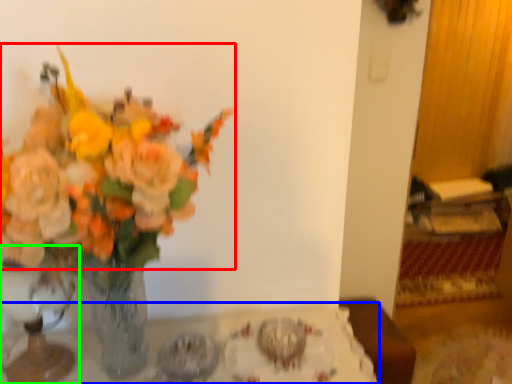
Question: Estimate the real-world distances between objects in this image. Which object is closer to flower (highlighted by a red box), table (highlighted by a blue box) or vase (highlighted by a green box)?

Choices:
 (A) table
 (B) vase

Answer: (B)